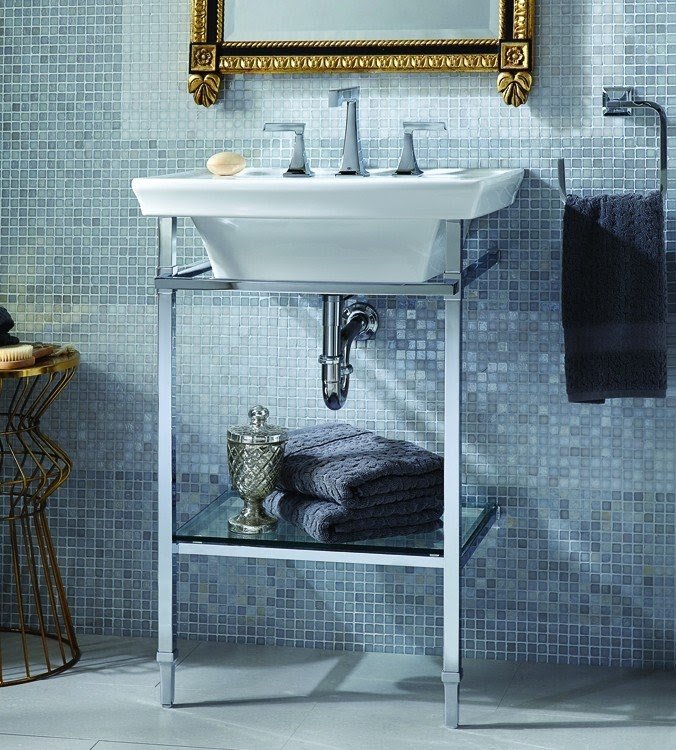
You are a GUI agent. You are given a task and a screenshot of the screen. Output one action in this format:
    pyautogui.click(x=<x>, y=<y>)
    Task: Click on the sink
    
    Given the screenshot: What is the action you would take?
    pyautogui.click(x=435, y=214)